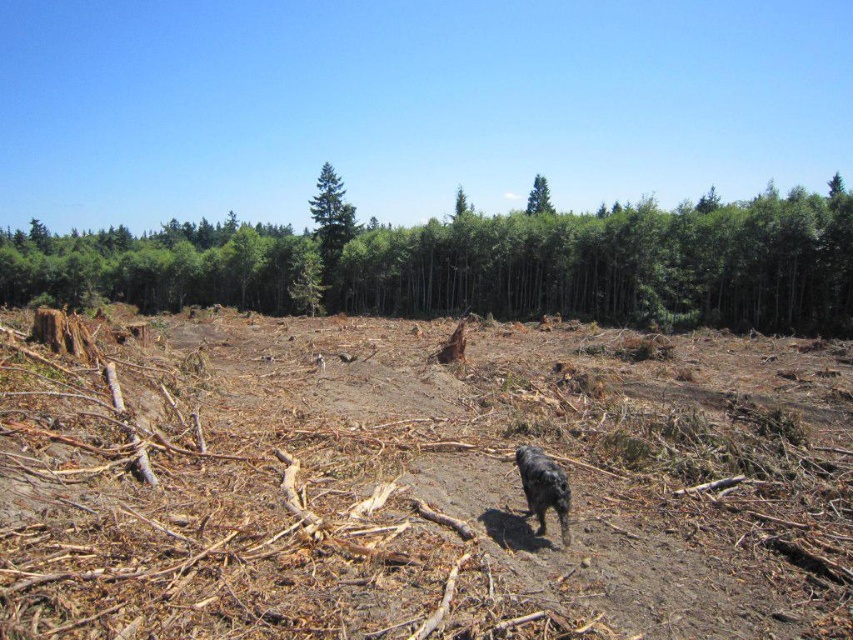
Question: Is green smooth tree at center wider than brown rough tree stump at center?

Choices:
 (A) no
 (B) yes

Answer: (B)

Question: Which point is farther to the camera?

Choices:
 (A) (537, 492)
 (B) (332, 275)
 (C) (456, 337)

Answer: (B)

Question: Which point appears farthest from the camera in this image?

Choices:
 (A) (531, 184)
 (B) (436, 355)
 (C) (548, 506)
 (D) (743, 396)

Answer: (A)

Question: Is brown dirt field at center wider than green textured tree at center?

Choices:
 (A) yes
 (B) no

Answer: (B)

Question: Can you confirm if green smooth tree at center is positioned to the right of brown rough tree stump at center?

Choices:
 (A) no
 (B) yes

Answer: (A)

Question: Which object is positioned closest to the green smooth tree at center?

Choices:
 (A) brown rough tree stump at center
 (B) green textured tree at center
 (C) green smooth tree at upper center

Answer: (B)